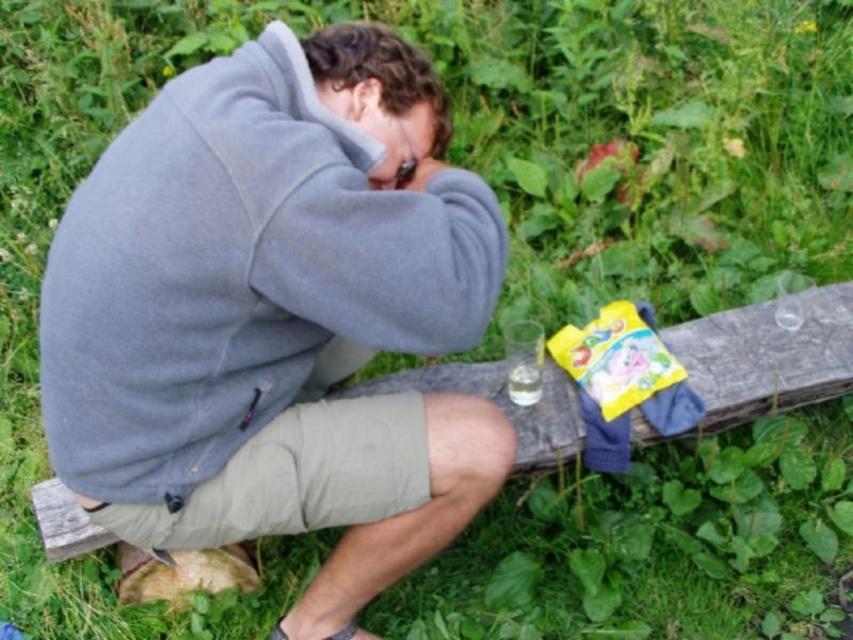
Is gray fleece jacket at center positioned before wooden bench at center?

Yes, gray fleece jacket at center is in front of wooden bench at center.

Consider the image. Between gray fleece jacket at center and wooden bench at center, which one has less height?

Standing shorter between the two is wooden bench at center.

At what (x,y) coordinates should I click in order to perform the action: click on gray fleece jacket at center. Please return your answer as a coordinate pair (x, y). This screenshot has width=853, height=640. Looking at the image, I should click on (276, 314).